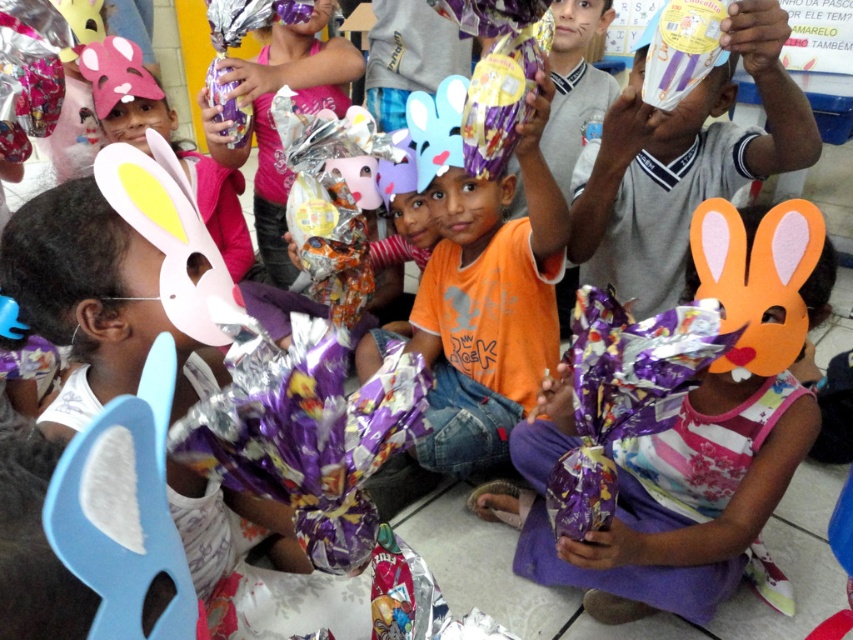
You are a photographer standing at a distance of 40 inches from the orange felt mask at center. Can you adjust your position to get a closer shot without moving the mask?

The orange felt mask at center is currently 38.75 inches away from the camera. Since you are standing 40 inches away, you need to move 1.25 inches closer to the orange felt mask at center to capture a closer shot.

Where is the orange felt mask at center located in the image?

The orange felt mask at center is located at point 0.683 on the horizontal axis and 0.814 on the vertical axis.